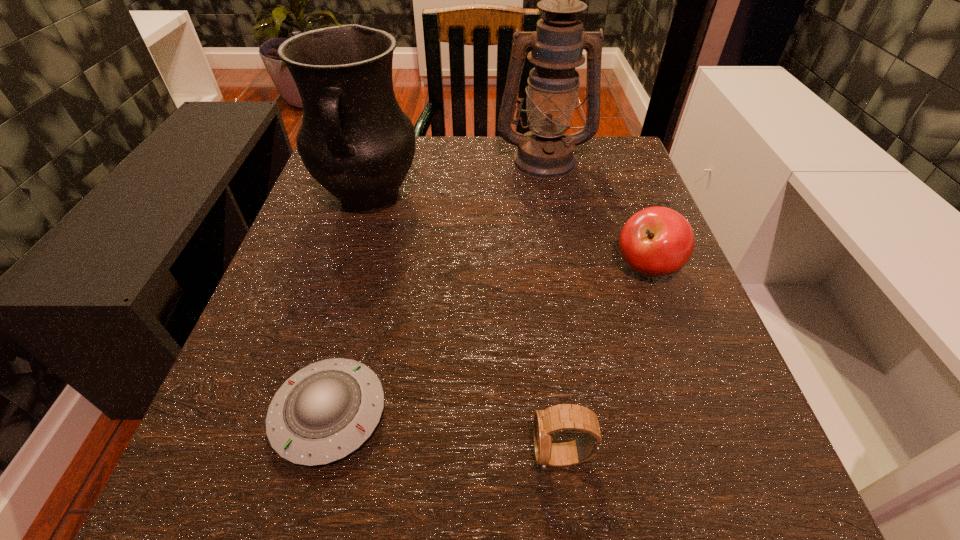
Identify the location of oil lamp. This screenshot has height=540, width=960. (545, 152).

This screenshot has height=540, width=960. What are the coordinates of `pitcher` in the screenshot? It's located at (355, 140).

Locate an element on the screen. apple is located at coordinates (657, 241).

Identify the location of watch. (560, 417).

You are a GUI agent. You are given a task and a screenshot of the screen. Output one action in this format:
    pyautogui.click(x=<x>, y=<y>)
    Task: Click on the shortest object
    This screenshot has height=540, width=960.
    Given the screenshot: What is the action you would take?
    pyautogui.click(x=325, y=411)

Where is `vacant area located 0.330m on the front of the oil lamp`? vacant area located 0.330m on the front of the oil lamp is located at coordinates (568, 291).

Locate an element on the screen. This screenshot has width=960, height=540. vacant space located on the handle side of the pitcher is located at coordinates (317, 379).

Where is `free spot located 0.380m on the back of the third farthest object`? free spot located 0.380m on the back of the third farthest object is located at coordinates (600, 143).

This screenshot has width=960, height=540. Find the location of `blank area located on the face of the watch`. blank area located on the face of the watch is located at coordinates (452, 456).

The image size is (960, 540). I want to click on vacant space located on the face of the watch, so click(317, 456).